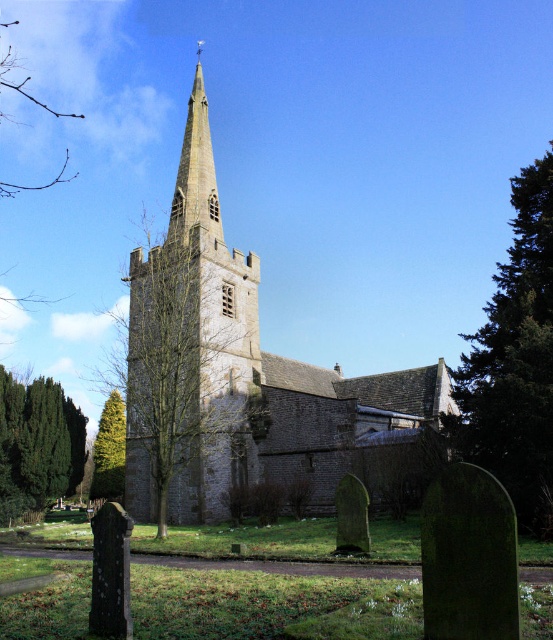
Which is in front, point (164, 483) or point (139, 387)?

Point (164, 483) is more forward.

Is point (321, 378) closer to camera compared to point (159, 266)?

No, it is behind (159, 266).

Between point (159, 296) and point (176, 307), which one is positioned in front?

Point (176, 307)

I want to click on gray stone church at center, so click(x=242, y=376).

Based on the photo, can you confirm if green leafy tree at center is positioned below green textured tree at lower left?

No, green leafy tree at center is not below green textured tree at lower left.

Between point (189, 301) and point (123, 413), which one is positioned behind?

The point (123, 413) is more distant.

Does point (156, 516) come behind point (108, 436)?

No, it is not.

Find the location of a particular element. The image size is (553, 640). green leafy tree at center is located at coordinates (179, 365).

What do you see at coordinates (514, 362) in the screenshot? I see `green leafy tree at right` at bounding box center [514, 362].

Between green leafy tree at right and green evergreen tree at lower left, which one has more height?

Standing taller between the two is green leafy tree at right.

Is point (542, 202) positioned in front of point (0, 442)?

Yes, point (542, 202) is in front of point (0, 442).

You are a GUI agent. You are given a task and a screenshot of the screen. Output one action in this format:
    pyautogui.click(x=<x>, y=<y>)
    Task: Click on the green leafy tree at right
    
    Given the screenshot: What is the action you would take?
    pyautogui.click(x=514, y=362)